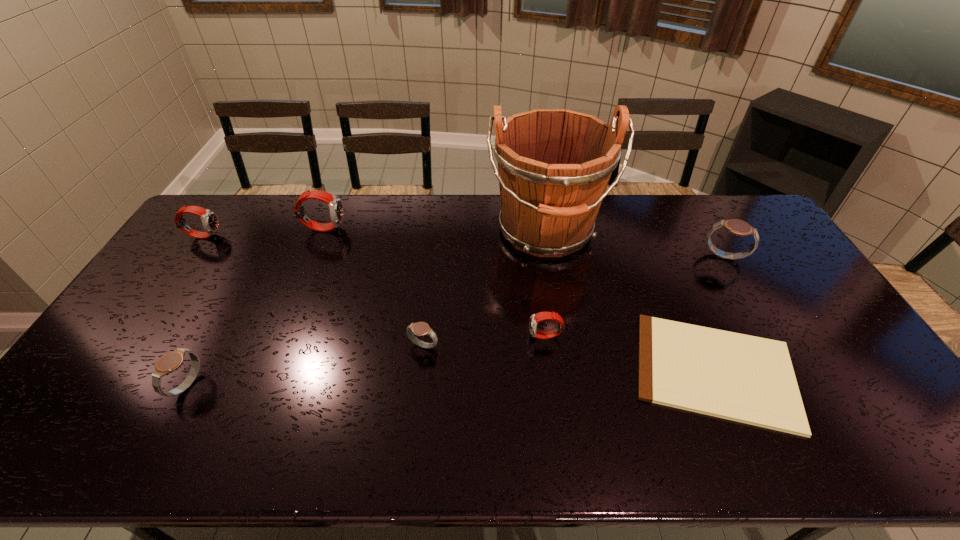
At what (x,y) coordinates should I click in order to perform the action: click on vacant space positioned 0.240m on the face of the fifth watch from left to right. Please return your answer as a coordinate pair (x, y). Looking at the image, I should click on (444, 336).

This screenshot has height=540, width=960. In order to click on vacant space situated on the face of the fifth watch from left to right in this screenshot , I will do `click(451, 336)`.

At what (x,y) coordinates should I click in order to perform the action: click on vacant space located 0.140m on the front of the fifth object from right to left. Please return your answer as a coordinate pair (x, y). The width and height of the screenshot is (960, 540). Looking at the image, I should click on (418, 401).

Locate an element on the screen. Image resolution: width=960 pixels, height=540 pixels. vacant space located on the right of the clipboard is located at coordinates (853, 371).

Find the location of a particular element. bucket positioned at the far edge is located at coordinates (554, 165).

Where is `object located in the near edge section of the desktop`? object located in the near edge section of the desktop is located at coordinates (747, 379).

Find the location of a particular element. object that is positioned at the left edge is located at coordinates (210, 222).

Identify the location of object present at the right edge. The width and height of the screenshot is (960, 540). (738, 227).

I want to click on object that is at the far left corner, so click(x=210, y=222).

The height and width of the screenshot is (540, 960). I want to click on vacant space at the far edge of the desktop, so click(x=388, y=212).